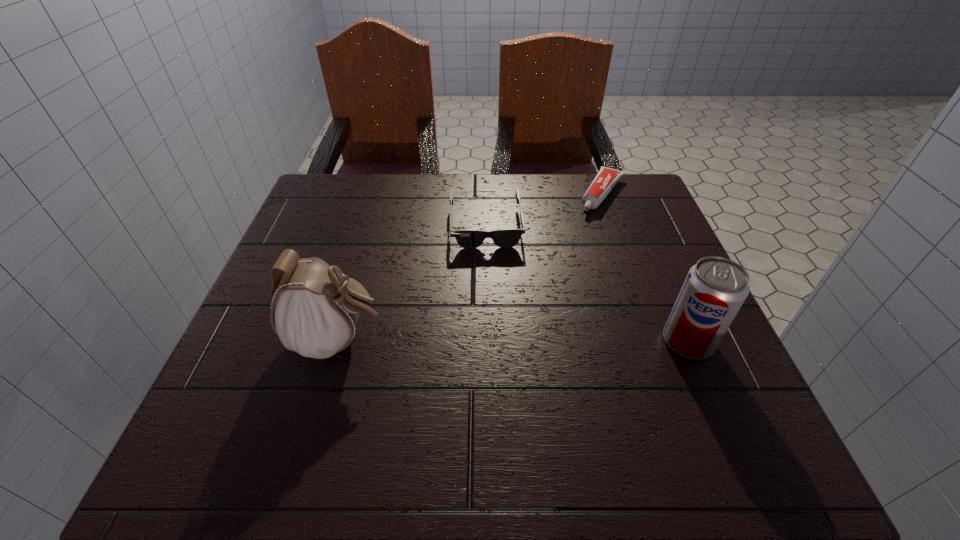
The height and width of the screenshot is (540, 960). I want to click on object that is at the far right corner, so [606, 179].

I want to click on free space at the far edge of the desktop, so click(x=497, y=197).

You are a GUI agent. You are given a task and a screenshot of the screen. Output one action in this format:
    pyautogui.click(x=<x>, y=<y>)
    Task: Click on the vacant space at the left edge of the desktop
    
    Given the screenshot: What is the action you would take?
    pyautogui.click(x=294, y=360)

In the image, there is a desktop. Identify the location of free region at the right edge. This screenshot has width=960, height=540. (648, 280).

You are a GUI agent. You are given a task and a screenshot of the screen. Output one action in this format:
    pyautogui.click(x=<x>, y=<y>)
    Task: Click on the vacant space at the far left corner
    Image resolution: width=960 pixels, height=540 pixels.
    Given the screenshot: What is the action you would take?
    pyautogui.click(x=320, y=174)

You are a GUI agent. You are given a task and a screenshot of the screen. Output one action in this format:
    pyautogui.click(x=<x>, y=<y>)
    Task: Click on the vacant region at the far right corner of the desktop
    
    Given the screenshot: What is the action you would take?
    pyautogui.click(x=644, y=191)

This screenshot has width=960, height=540. Identify the location of vacant region between the leftmost object and the shortest object. (470, 267).

The image size is (960, 540). In order to click on vacant point located between the third shortest object and the shortest object in this screenshot , I will do 645,267.

Locate an element on the screen. The image size is (960, 540). vacant area that lies between the pouch and the toothpaste is located at coordinates (470, 267).

The height and width of the screenshot is (540, 960). What are the coordinates of `empty space between the leftmost object and the shortest object` in the screenshot? It's located at (470, 267).